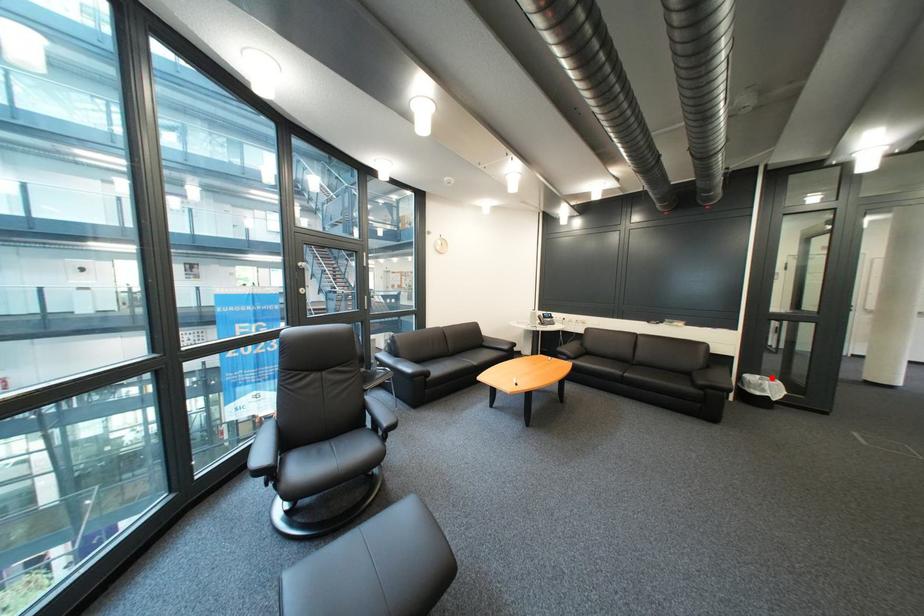
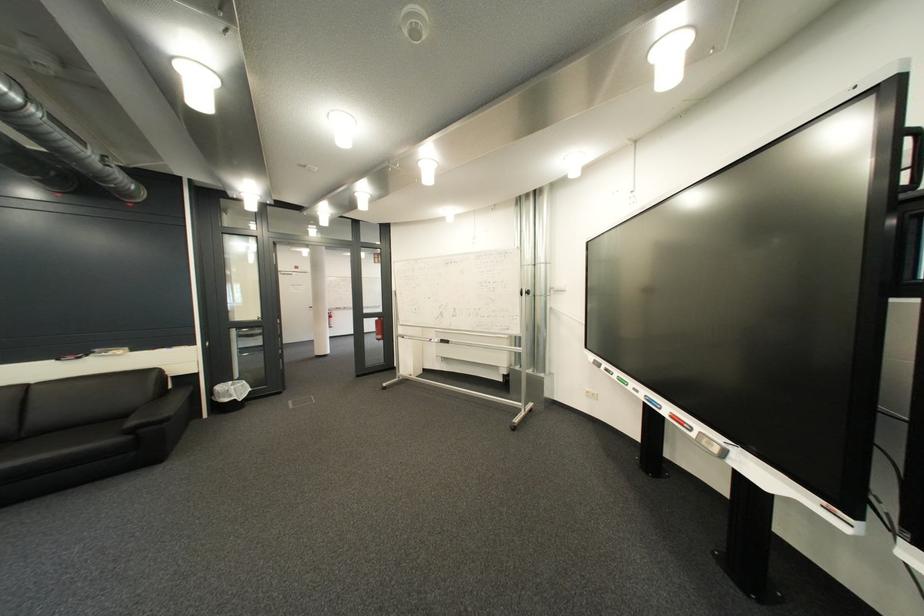
In the second image, find the point that corresponds to the highlighted location in the first image.

(245, 384)